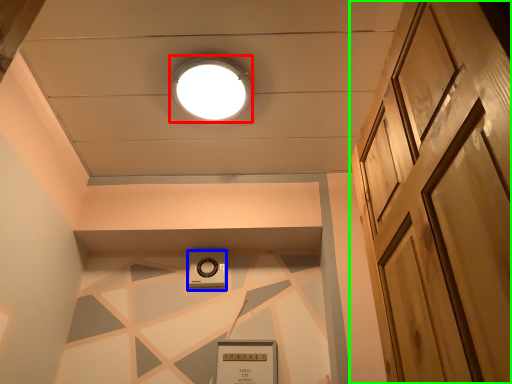
Question: Estimate the real-world distances between objects in this image. Which object is closer to droplight (highlighted by a red box), thermostat (highlighted by a blue box) or door (highlighted by a green box)?

Choices:
 (A) thermostat
 (B) door

Answer: (A)